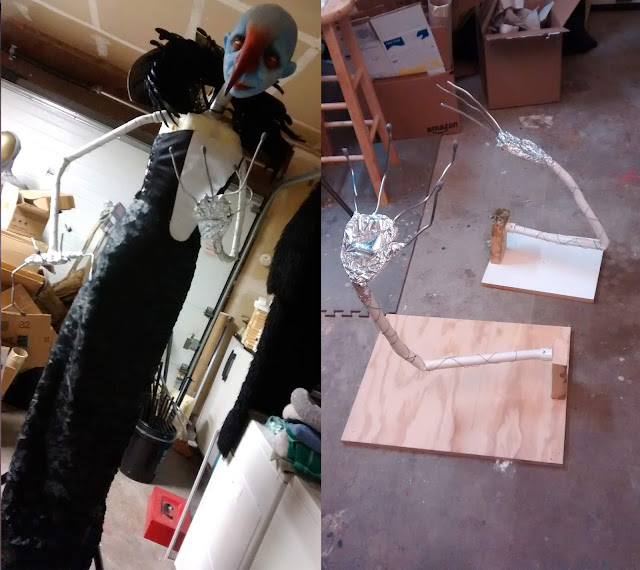
I want to click on cardboard box, so click(34, 223).